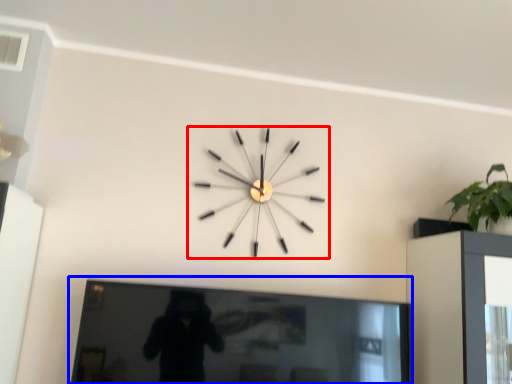
Question: Among these objects, which one is nearest to the camera, wall clock (highlighted by a red box) or picture frame (highlighted by a blue box)?

Choices:
 (A) wall clock
 (B) picture frame

Answer: (B)